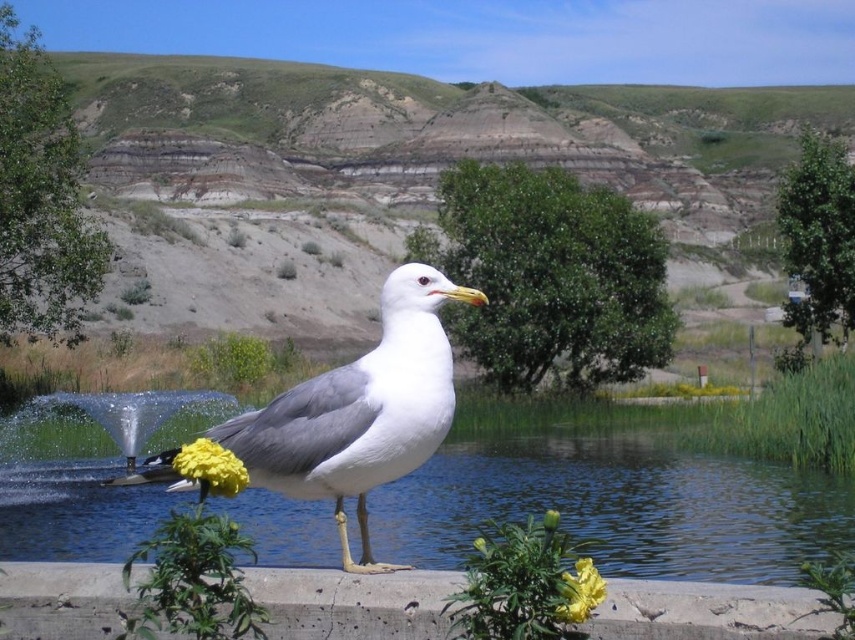
Question: Which object is closer to the camera taking this photo?

Choices:
 (A) yellow matte flower at lower center
 (B) white matte seagull at center
 (C) clear blue water at center

Answer: (A)

Question: Can you confirm if white matte seagull at center is positioned to the right of yellow matte flower at lower center?

Choices:
 (A) no
 (B) yes

Answer: (A)

Question: Among these objects, which one is farthest from the camera?

Choices:
 (A) clear blue water at center
 (B) white matte seagull at center

Answer: (A)

Question: Which object appears closest to the camera in this image?

Choices:
 (A) clear blue water at center
 (B) yellow matte flower at lower center
 (C) white matte seagull at center

Answer: (B)

Question: Can you confirm if clear blue water at center is thinner than yellow matte flower at lower center?

Choices:
 (A) yes
 (B) no

Answer: (B)

Question: Does clear blue water at center have a lesser width compared to yellow matte flower at center?

Choices:
 (A) yes
 (B) no

Answer: (B)